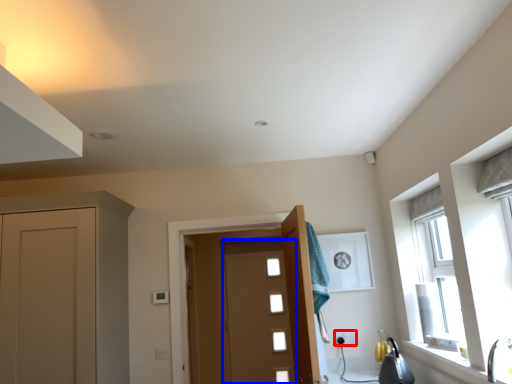
Question: Which point is further to the camera, electric outlet (highlighted by a red box) or door (highlighted by a blue box)?

Choices:
 (A) electric outlet
 (B) door

Answer: (B)